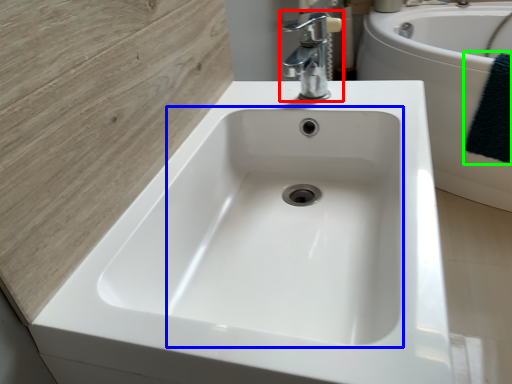
Question: Estimate the real-world distances between objects in this image. Which object is closer to tap (highlighted by a red box), sink (highlighted by a blue box) or bath towel (highlighted by a green box)?

Choices:
 (A) sink
 (B) bath towel

Answer: (A)